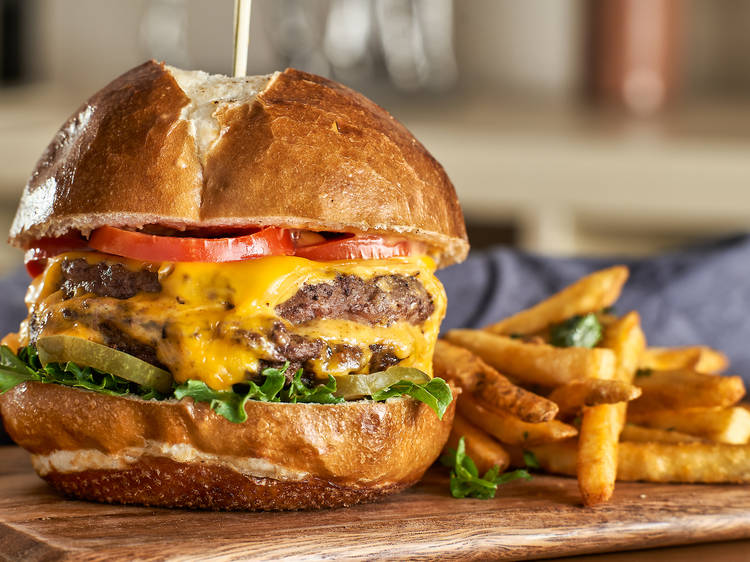
This screenshot has height=562, width=750. Find the location of `wooden plate`. wooden plate is located at coordinates (427, 516).